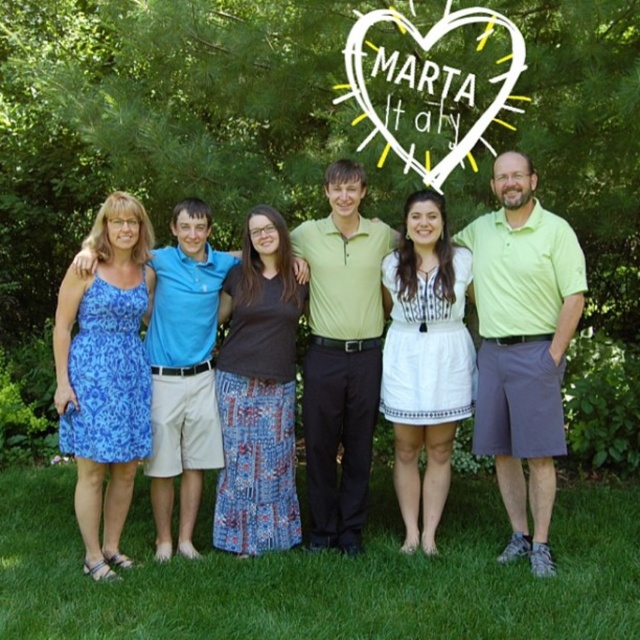
You are a photographer setting up a camera on a tripod. The camera is positioned so that it faces the group of people in the park. You want to ensure that both the green grass at lower center and the matte green polo shirt at center are in focus. Given that the camera can only focus on objects within a 5 feet range, will both objects be in focus?

The distance between the green grass at lower center and the matte green polo shirt at center is 4.62 feet, which is within the 5 feet range. Therefore, both objects will be in focus.

You are standing in the park and looking at the green grass at lower center and the matte green polo shirt at center. Which one is closer to you?

The green grass at lower center is closer to the viewer than the matte green polo shirt at center.